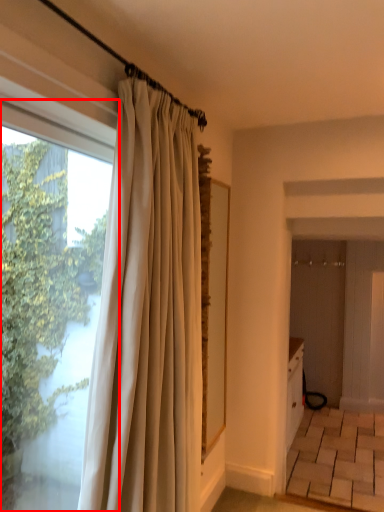
Question: From the image's perspective, considering the relative positions of window (annotated by the red box) and curtain in the image provided, where is window (annotated by the red box) located with respect to the staircase?

Choices:
 (A) below
 (B) above

Answer: (B)